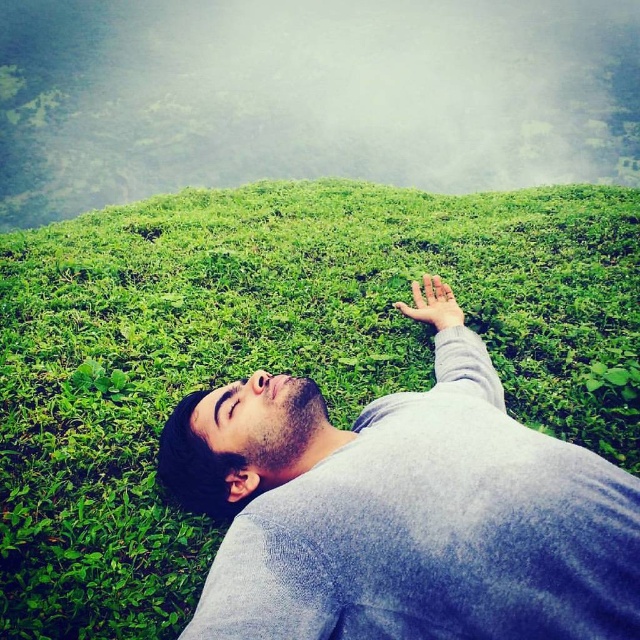
Who is more distant from viewer, (220,428) or (440,326)?

The point (440,326) is more distant.

Is point (403, 497) farther from camera compared to point (432, 289)?

No, it is not.

Locate an element on the screen. The height and width of the screenshot is (640, 640). gray cotton shirt at center is located at coordinates (403, 515).

Locate an element on the screen. gray cotton shirt at center is located at coordinates (403, 515).